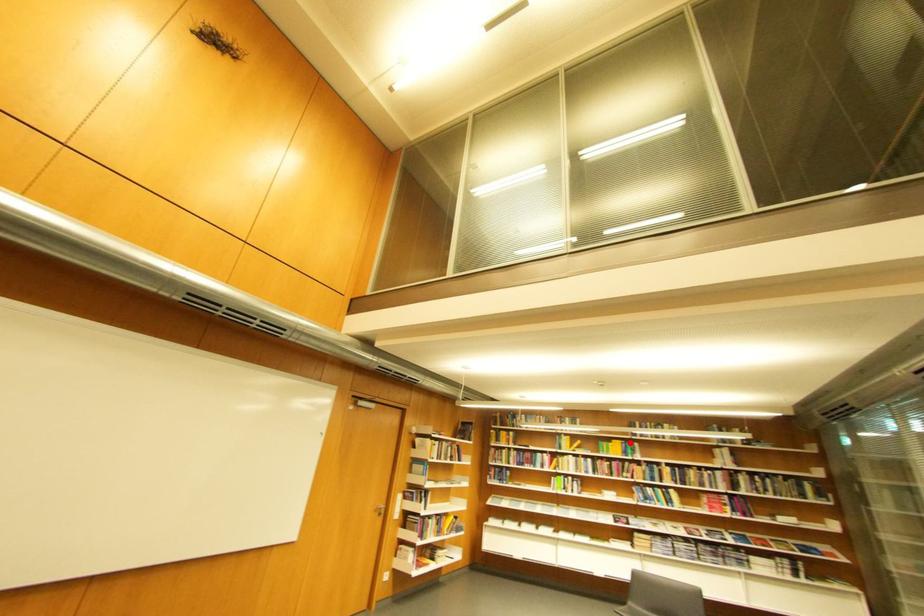
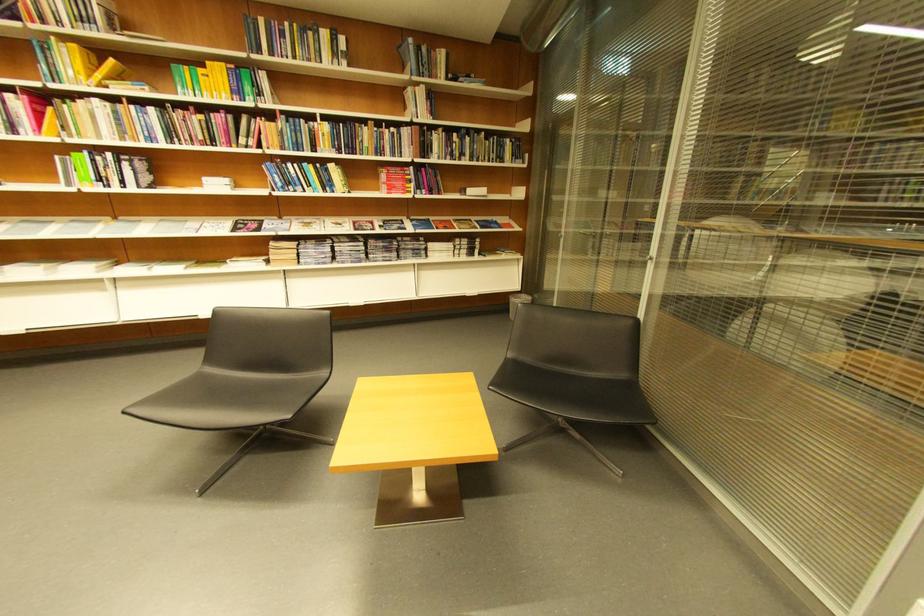
Question: I am providing you with two images of the same scene from different viewpoints. A red point is marked on the first image. Is the red point's position out of view in image 2?

Choices:
 (A) Yes
 (B) No

Answer: (B)